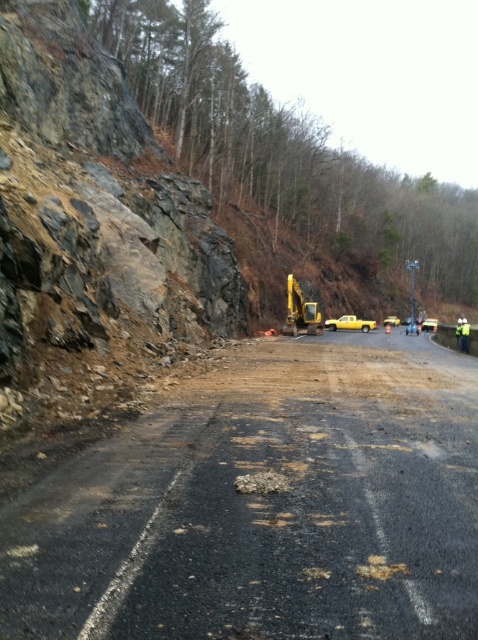
Question: Where is asphalt road at center located in relation to yellow rubber excavator at center in the image?

Choices:
 (A) below
 (B) above

Answer: (A)

Question: Which object is farther from the camera taking this photo?

Choices:
 (A) asphalt road at center
 (B) yellow rubber excavator at center

Answer: (B)

Question: Which object is closer to the camera taking this photo?

Choices:
 (A) yellow rubber excavator at center
 (B) asphalt road at center

Answer: (B)

Question: Does asphalt road at center appear on the left side of yellow rubber excavator at center?

Choices:
 (A) no
 (B) yes

Answer: (B)

Question: Among these points, which one is nearest to the camera?

Choices:
 (A) (433, 364)
 (B) (316, 310)

Answer: (A)

Question: Does asphalt road at center have a larger size compared to yellow rubber excavator at center?

Choices:
 (A) yes
 (B) no

Answer: (B)